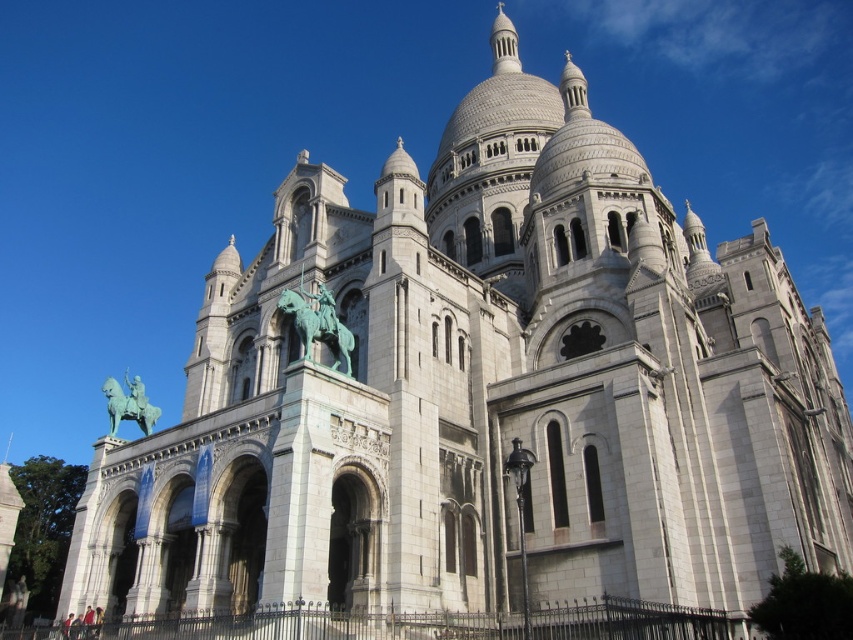
Consider the image. How far apart are green patinated bronze statue of a rider at center and green patina statue at center?

green patinated bronze statue of a rider at center is 91.98 feet from green patina statue at center.

Who is more distant from viewer, (323, 324) or (138, 420)?

Point (138, 420)

Image resolution: width=853 pixels, height=640 pixels. I want to click on green patinated bronze statue of a rider at center, so click(318, 323).